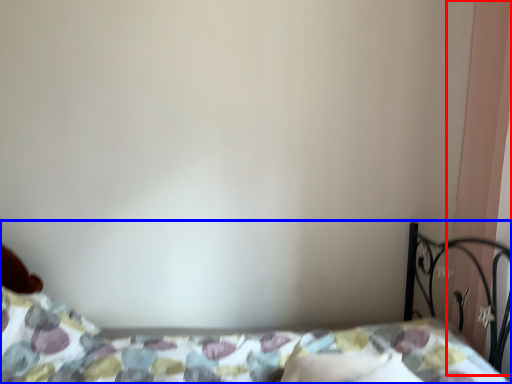
Question: Which point is further to the camera, curtain (highlighted by a red box) or bed (highlighted by a blue box)?

Choices:
 (A) curtain
 (B) bed

Answer: (A)